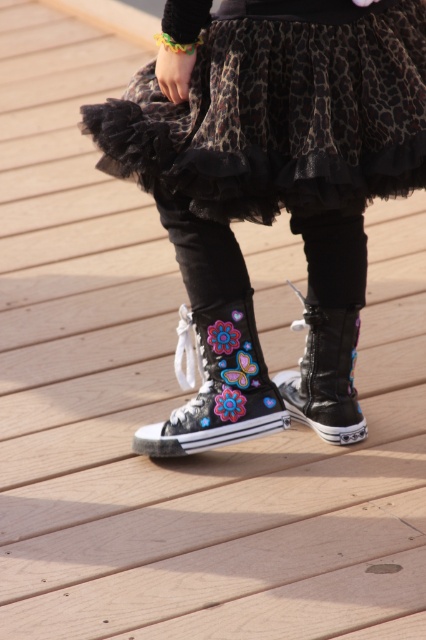
Who is taller, black canvas boots at center or black canvas boot at center?

black canvas boots at center

Based on the photo, is black canvas boots at center wider than black canvas boot at center?

Yes, black canvas boots at center is wider than black canvas boot at center.

Which is in front, point (244, 163) or point (334, 429)?

Point (244, 163) is in front.

Where is `black canvas boots at center`? The width and height of the screenshot is (426, 640). black canvas boots at center is located at coordinates (270, 186).

Find the location of a particular element. The image size is (426, 640). black canvas boots at center is located at coordinates (270, 186).

Is black canvas boots at center smaller than leopard print tulle skirt at center?

Actually, black canvas boots at center might be larger than leopard print tulle skirt at center.

Measure the distance between point [374,124] and camera.

6.96 feet

I want to click on black canvas boots at center, so click(270, 186).

Who is taller, leopard print tulle skirt at center or black canvas shoe at center?

Standing taller between the two is leopard print tulle skirt at center.

Is leopard print tulle skirt at center to the left of black canvas shoe at center from the viewer's perspective?

In fact, leopard print tulle skirt at center is to the right of black canvas shoe at center.

Find the location of a particular element. This screenshot has height=640, width=426. leopard print tulle skirt at center is located at coordinates (279, 115).